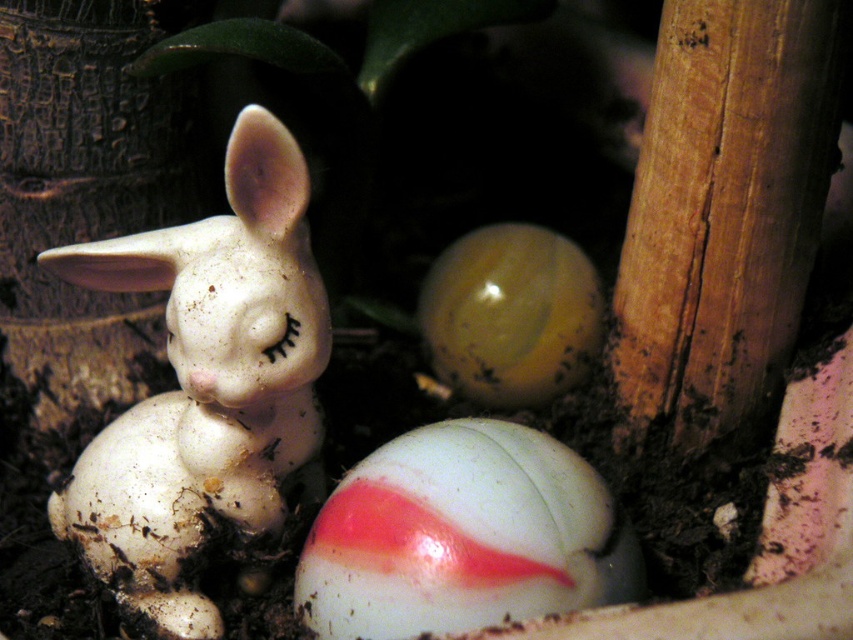
You are an archaeologist examining a dig site. You see a white matte rabbit at center and a point marked at coordinates [206,385]. Is the rabbit located at that point?

Yes, the white matte rabbit at center is located at point [206,385].

You are an artist planning to paint the scene with the white matte rabbit at center and the translucent yellow egg at center. If you want to emphasize the size difference between them, how should you position them in your painting?

Since the white matte rabbit at center is bigger than the translucent yellow egg at center, you should place the white matte rabbit at center in a central position and make it larger than the translucent yellow egg at center to highlight their size difference.